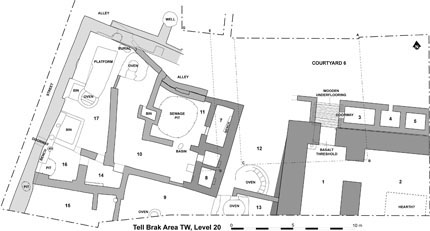
Where is `room 1`? room 1 is located at coordinates (322, 185).